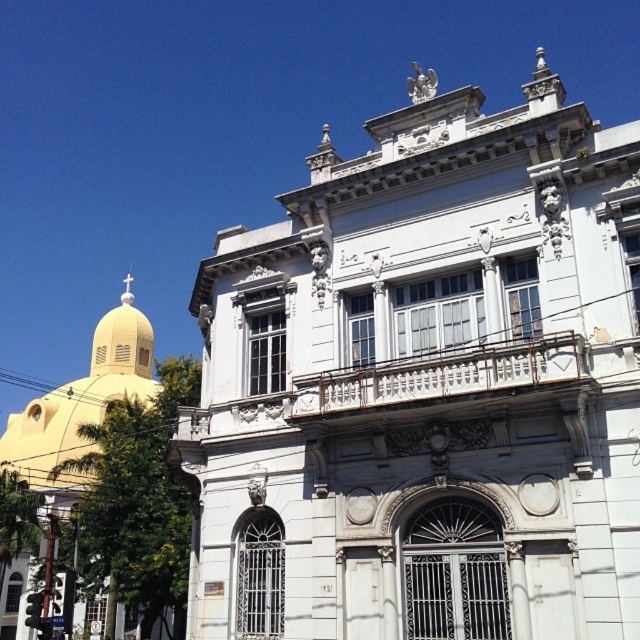
Question: Which point is farther to the camera?

Choices:
 (A) (560, 307)
 (B) (140, 348)

Answer: (B)

Question: Observing the image, what is the correct spatial positioning of matte yellow dome at upper left in reference to matte yellow dome at left?

Choices:
 (A) below
 (B) above

Answer: (B)

Question: Does matte yellow dome at upper left have a smaller size compared to matte yellow dome at left?

Choices:
 (A) no
 (B) yes

Answer: (A)

Question: Among these objects, which one is farthest from the camera?

Choices:
 (A) matte yellow dome at upper left
 (B) matte yellow dome at left

Answer: (B)

Question: Is matte yellow dome at upper left thinner than matte yellow dome at left?

Choices:
 (A) yes
 (B) no

Answer: (B)